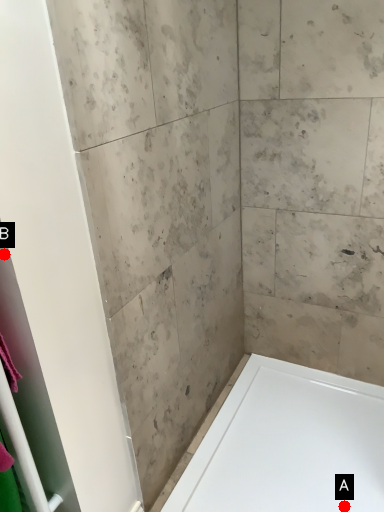
Question: Two points are circled on the image, labeled by A and B beside each circle. Which point is further to the camera?

Choices:
 (A) A is further
 (B) B is further

Answer: (A)